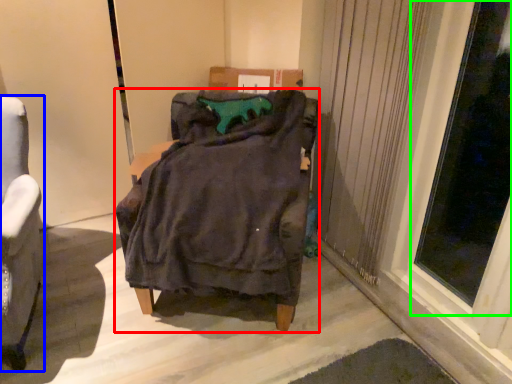
Question: Based on their relative distances, which object is nearer to furniture (highlighted by a red box)? Choose from chair (highlighted by a blue box) and window (highlighted by a green box).

Choices:
 (A) chair
 (B) window

Answer: (A)